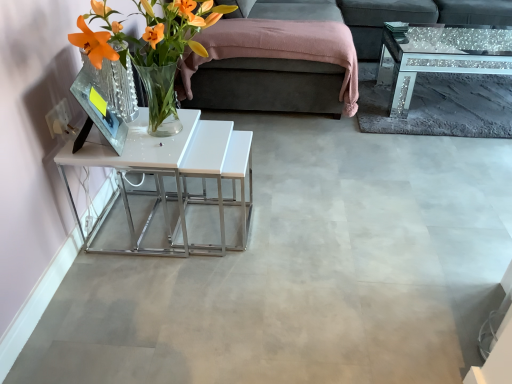
Question: From a real-world perspective, is sparkly glass coffee table at upper right above or below translucent glass vase at left?

Choices:
 (A) above
 (B) below

Answer: (B)

Question: Choose the correct answer: Is sparkly glass coffee table at upper right inside translucent glass vase at left or outside it?

Choices:
 (A) inside
 (B) outside

Answer: (B)

Question: Which of these objects is positioned farthest from the sparkly glass coffee table at upper right?

Choices:
 (A) dark gray fabric studio couch at upper center
 (B) dark gray fabric couch at upper right
 (C) translucent glass vase at left
 (D) white glossy table at left

Answer: (C)

Question: Which is farther from the sparkly glass coffee table at upper right?

Choices:
 (A) translucent glass vase at left
 (B) white glossy table at left
 (C) dark gray fabric studio couch at upper center
 (D) dark gray fabric couch at upper right

Answer: (A)